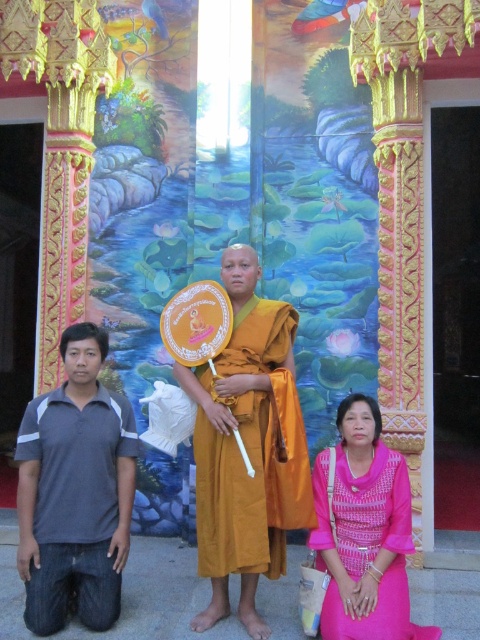
You are standing in front of the vibrant backdrop with the three individuals. There is a point marked at coordinates point (287, 483). Considering your current position, can you reach this point without moving your feet?

The point (287, 483) is 52.28 feet away from the viewer, so no, you cannot reach it without moving your feet since it is too far away.